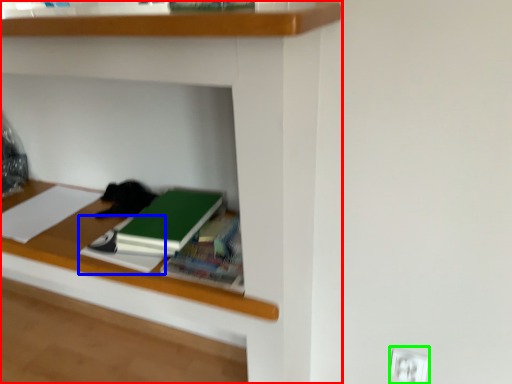
Question: Estimate the real-world distances between objects in this image. Which object is closer to shelf (highlighted by a red box), notebook (highlighted by a blue box) or electric outlet (highlighted by a green box)?

Choices:
 (A) notebook
 (B) electric outlet

Answer: (A)